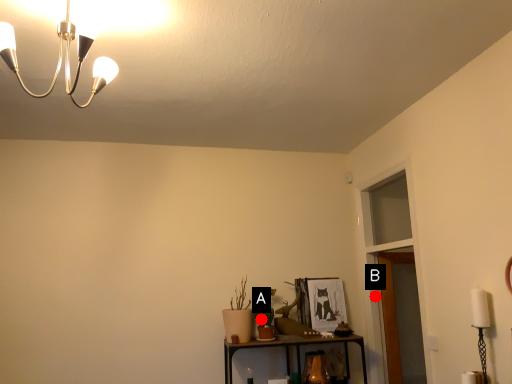
Question: Two points are circled on the image, labeled by A and B beside each circle. Which point is closer to the camera taking this photo?

Choices:
 (A) A is closer
 (B) B is closer

Answer: (A)